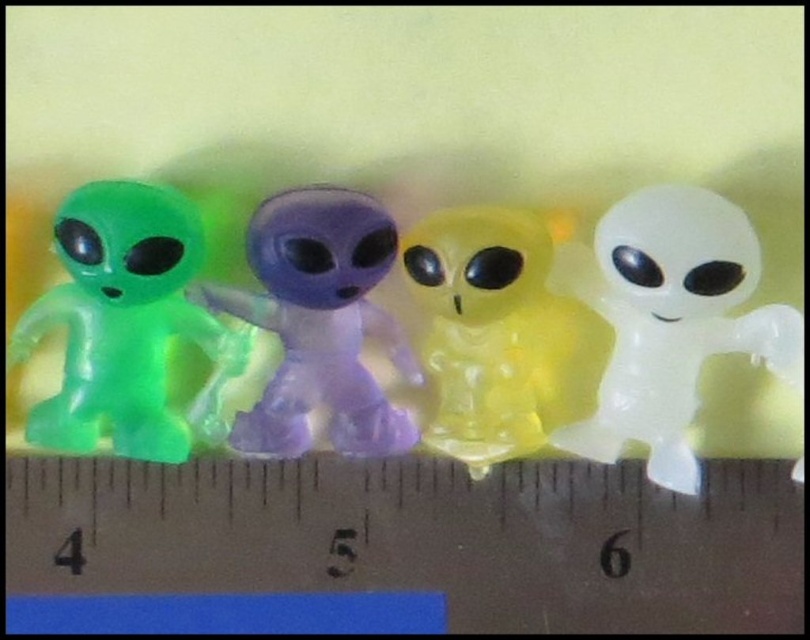
Question: Which of these objects is positioned closest to the green translucent alien at left?

Choices:
 (A) transparent white alien at right
 (B) translucent purple alien at center
 (C) translucent yellow alien at center
 (D) transparent plastic ruler at lower center

Answer: (B)

Question: In this image, where is transparent plastic ruler at lower center located relative to transparent white alien at right?

Choices:
 (A) right
 (B) left

Answer: (B)

Question: Based on their relative distances, which object is nearer to the translucent purple alien at center?

Choices:
 (A) transparent white alien at right
 (B) translucent yellow alien at center

Answer: (B)

Question: Does green translucent alien at left have a lesser width compared to translucent yellow alien at center?

Choices:
 (A) yes
 (B) no

Answer: (B)

Question: Considering the real-world distances, which object is closest to the transparent plastic ruler at lower center?

Choices:
 (A) translucent purple alien at center
 (B) green translucent alien at left

Answer: (A)

Question: Is green translucent alien at left bigger than translucent purple alien at center?

Choices:
 (A) no
 (B) yes

Answer: (B)